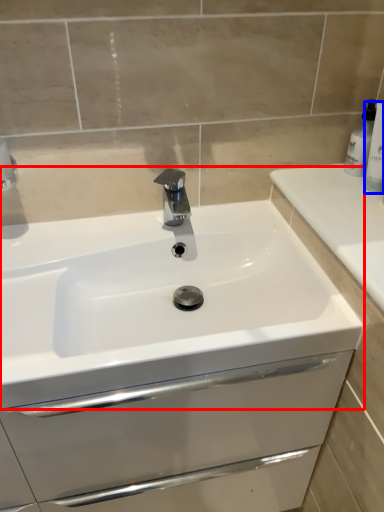
Question: Among these objects, which one is nearest to the camera, sink (highlighted by a red box) or toiletry (highlighted by a blue box)?

Choices:
 (A) sink
 (B) toiletry

Answer: (A)